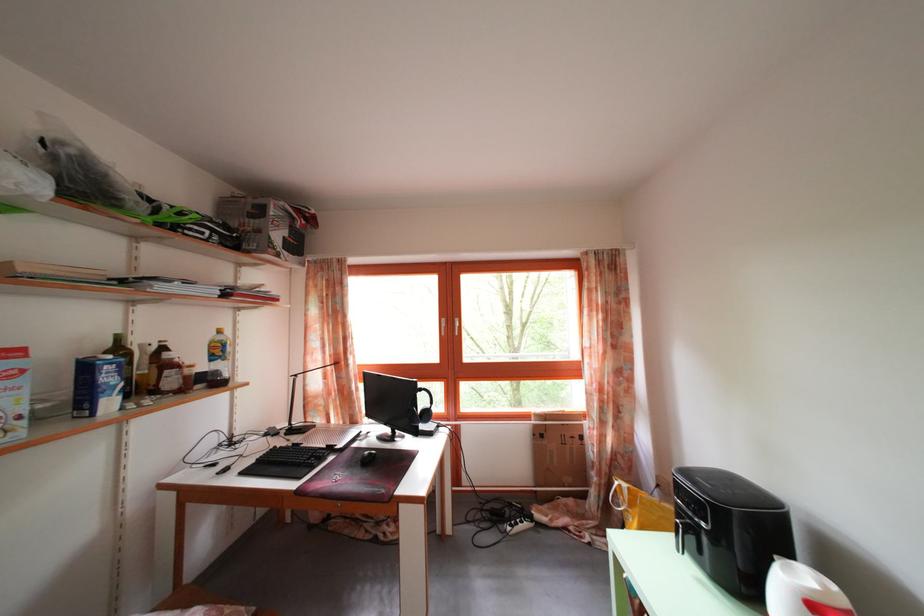
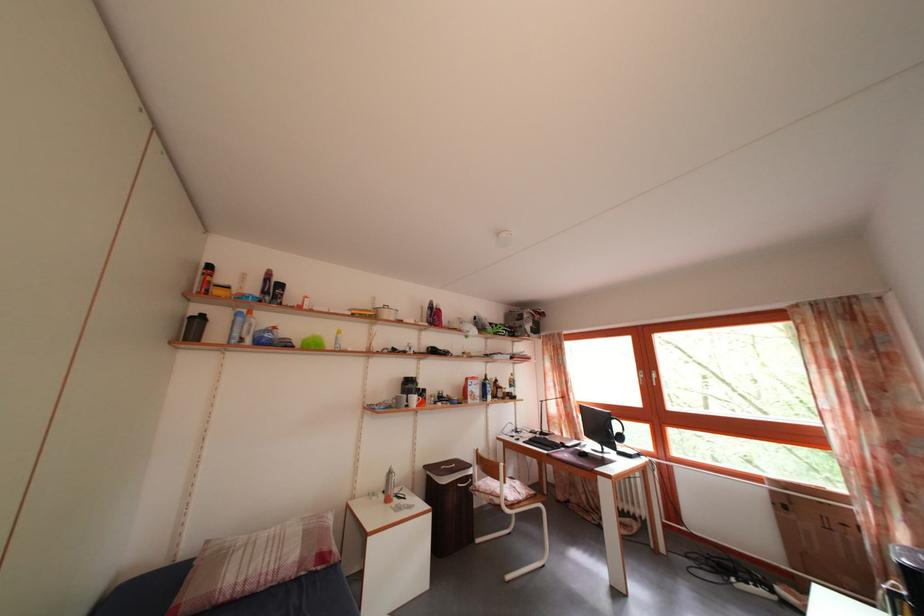
Find the pixel in the second image that matches [298,438] in the first image.

(550, 440)